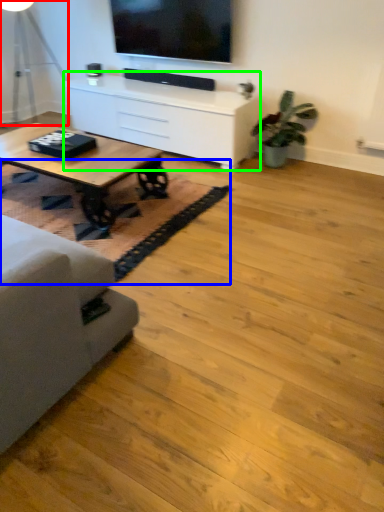
Question: Which object is positioned farthest from table lamp (highlighted by a red box)? Select from mat (highlighted by a blue box) and table (highlighted by a green box).

Choices:
 (A) mat
 (B) table

Answer: (A)